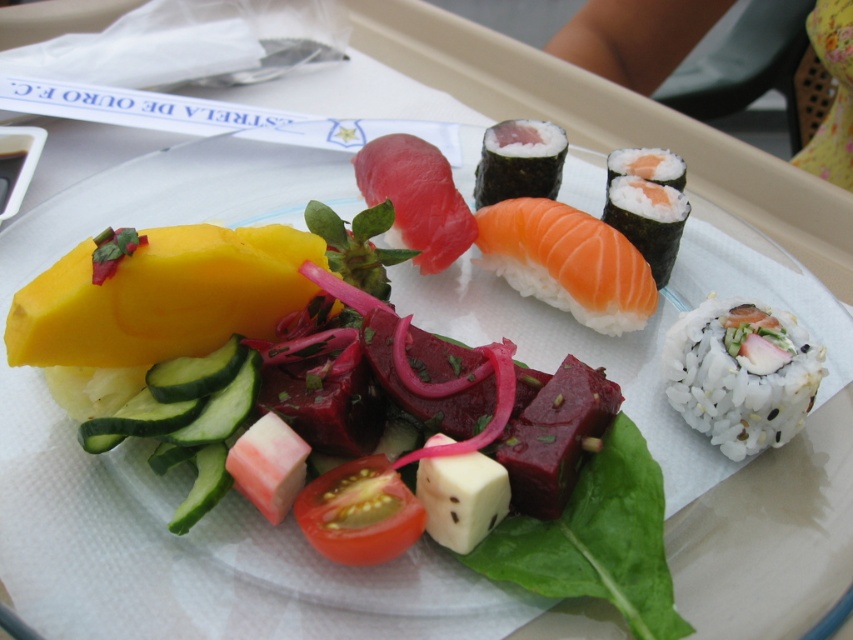
You are arranging a small appetizer platter and need to place both the white soft cube at center and the white rice wrapped in seaweed at upper right. Given their sizes, which one can you fit more of on the platter?

The white soft cube at center has a lesser width compared to the white rice wrapped in seaweed at upper right, so you can fit more of the white soft cube at center on the platter since it is smaller in size.

You are a food critic evaluating the portion sizes of the items on the plate. Which item is smaller in size between the white soft cube at center and the white rice wrapped in seaweed at upper right?

The white soft cube at center is smaller than the white rice wrapped in seaweed at upper right.